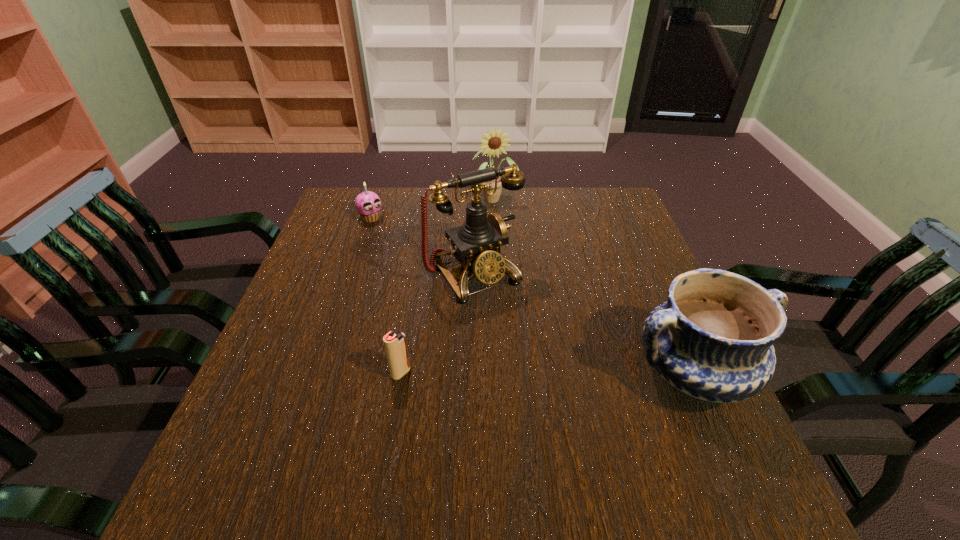
Where is `blank space located on the back of the pottery`? blank space located on the back of the pottery is located at coordinates (652, 281).

This screenshot has height=540, width=960. In order to click on vacant space situated on the front of the telephone, featuring the rotary dial in this screenshot , I will do `click(570, 403)`.

Image resolution: width=960 pixels, height=540 pixels. In order to click on vacant space located on the front of the telephone, featuring the rotary dial in this screenshot , I will do `click(574, 408)`.

Find the location of a particular element. free location located 0.260m on the front of the telephone, featuring the rotary dial is located at coordinates (559, 387).

Locate an element on the screen. The image size is (960, 540). vacant area situated 0.300m on the face of the fourth nearest object is located at coordinates (436, 276).

You are a GUI agent. You are given a task and a screenshot of the screen. Output one action in this format:
    pyautogui.click(x=<x>, y=<y>)
    Task: Click on the vacant space located 0.190m on the face of the fourth nearest object
    The width and height of the screenshot is (960, 540).
    Given the screenshot: What is the action you would take?
    pyautogui.click(x=412, y=255)

This screenshot has height=540, width=960. What are the coordinates of `free point located 0.270m on the face of the fourth nearest object` in the screenshot? It's located at (429, 270).

Where is `blank space located on the front-facing side of the sunflower`? blank space located on the front-facing side of the sunflower is located at coordinates (506, 226).

Where is `vacant space located 0.100m on the front-facing side of the sunflower`? vacant space located 0.100m on the front-facing side of the sunflower is located at coordinates (505, 225).

The image size is (960, 540). I want to click on blank space located on the front-facing side of the sunflower, so click(524, 275).